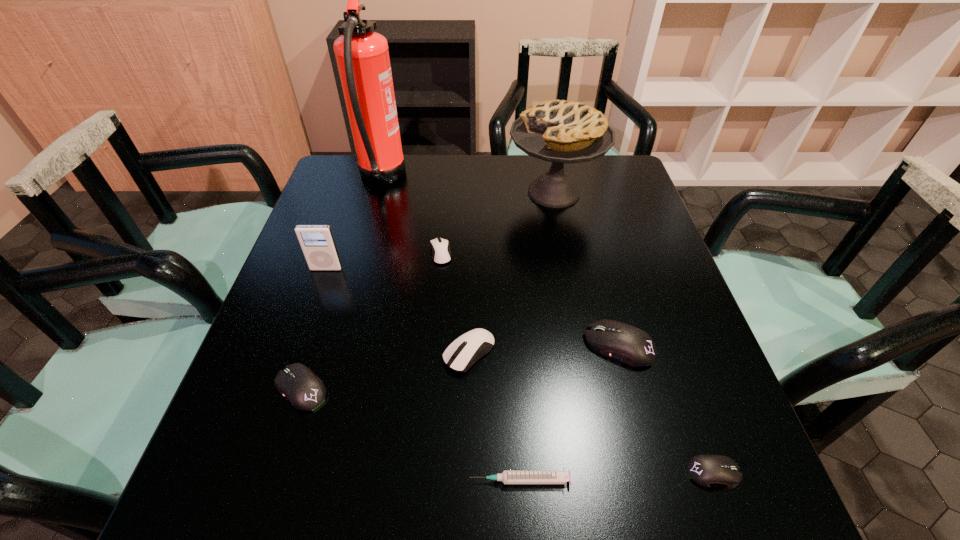
In the image, there is a desktop. Where is `vacant space at the left edge`? This screenshot has width=960, height=540. vacant space at the left edge is located at coordinates (x=295, y=281).

In order to click on vacant position at the right edge of the desktop in this screenshot , I will do `click(676, 452)`.

The width and height of the screenshot is (960, 540). What are the coordinates of `free space at the far left corner` in the screenshot? It's located at click(x=343, y=159).

In the image, there is a desktop. Identify the location of vacant space at the far right corner. This screenshot has height=540, width=960. (631, 178).

Locate an element on the screen. This screenshot has width=960, height=540. free space between the farther white mouse and the second smallest black computer equipment is located at coordinates pyautogui.click(x=371, y=321).

At what (x,y) coordinates should I click in order to perform the action: click on unoccupied position between the syringe and the bigger white mouse. Please return your answer as a coordinate pair (x, y). This screenshot has width=960, height=540. Looking at the image, I should click on (494, 416).

Where is `empty location between the nearer white mouse and the biggest black computer equipment`? empty location between the nearer white mouse and the biggest black computer equipment is located at coordinates (x=544, y=349).

The height and width of the screenshot is (540, 960). Find the location of `free spot between the sixth nearest object and the eighth shortest object`. free spot between the sixth nearest object and the eighth shortest object is located at coordinates (440, 231).

Where is `free space between the red fire extinguisher and the eighth shortest object`? free space between the red fire extinguisher and the eighth shortest object is located at coordinates 468,185.

Where is `free space between the second biggest black computer equipment and the nearest computer equipment`? This screenshot has height=540, width=960. free space between the second biggest black computer equipment and the nearest computer equipment is located at coordinates pos(507,430).